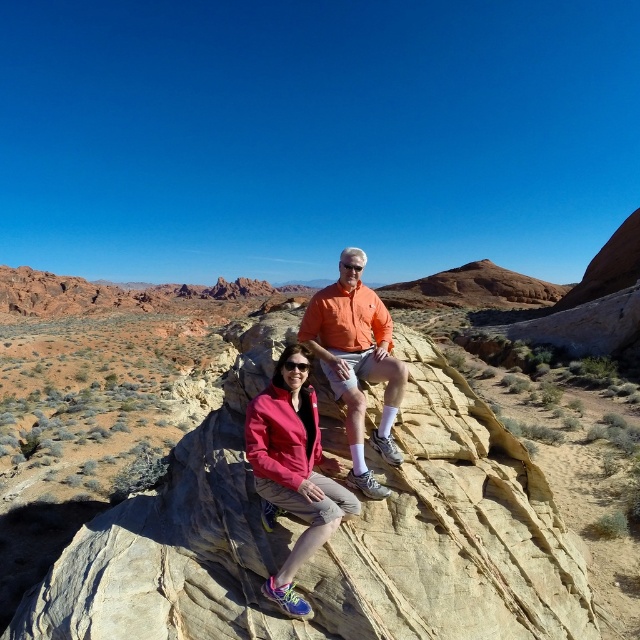
You are planning to set up a campsite in the desert. You have a tent that requires a flat area of at least 15 feet in length. You see the smooth sandstone rock at center and the orange cotton shirt at center. Is there enough space between them to set up your tent?

The distance between the smooth sandstone rock at center and the orange cotton shirt at center is 16.85 feet, which is greater than the required 15 feet. Therefore, there is sufficient space to set up the tent between them.

From the picture: You are planning to set up a small campsite between the smooth sandstone rock at center and the matte pink jacket at center. Based on the scene description, can you determine if there is enough space between them to accommodate a standard tent that requires a 2 meter by 2 meter area?

The smooth sandstone rock at center might be wider than matte pink jacket at center, but the exact dimensions are not provided. Without knowing the actual width of the rock or the jacket, it is impossible to determine if there is sufficient space for the tent.